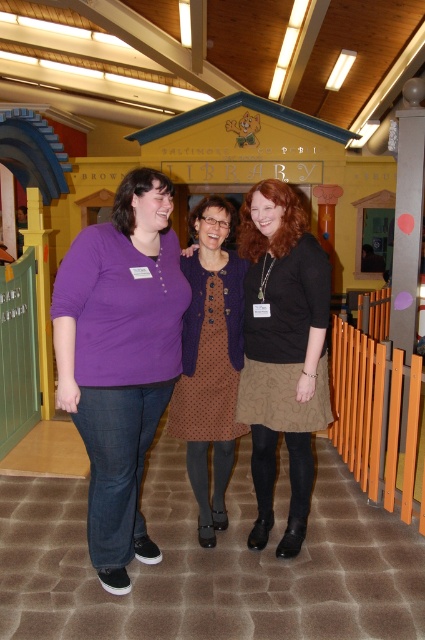
Does purple cotton shirt at center have a lesser height compared to brown textured dress at center?

No, purple cotton shirt at center is not shorter than brown textured dress at center.

Can you confirm if purple cotton shirt at center is thinner than brown textured dress at center?

No.

Where is `purple cotton shirt at center`? The width and height of the screenshot is (425, 640). purple cotton shirt at center is located at coordinates (119, 358).

Is brown textured dress at center to the left of brown dotted dress at center from the viewer's perspective?

No, brown textured dress at center is not to the left of brown dotted dress at center.

Does brown textured dress at center have a smaller size compared to brown dotted dress at center?

Yes, brown textured dress at center is smaller than brown dotted dress at center.

Which is in front, point (251, 394) or point (237, 337)?

Positioned in front is point (251, 394).

Locate an element on the screen. brown textured dress at center is located at coordinates (283, 349).

Between purple cotton shirt at center and brown dotted dress at center, which one appears on the right side from the viewer's perspective?

brown dotted dress at center is more to the right.

Who is taller, purple cotton shirt at center or brown dotted dress at center?

purple cotton shirt at center is taller.

The image size is (425, 640). What are the coordinates of `purple cotton shirt at center` in the screenshot? It's located at (119, 358).

Locate an element on the screen. purple cotton shirt at center is located at coordinates (119, 358).